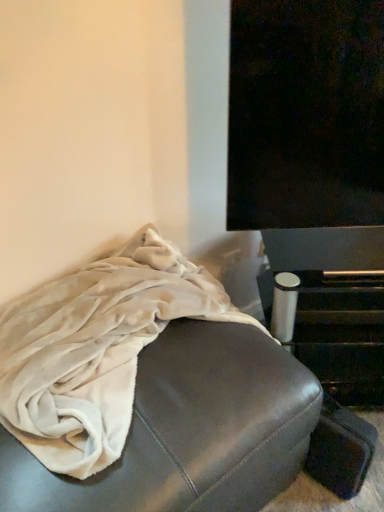
I want to click on velvet-like beige blanket draped over leather ottoman at lower left, so click(190, 430).

What do you see at coordinates (190, 430) in the screenshot?
I see `velvet-like beige blanket draped over leather ottoman at lower left` at bounding box center [190, 430].

You are a GUI agent. You are given a task and a screenshot of the screen. Output one action in this format:
    pyautogui.click(x=<x>, y=<y>)
    Task: Click on the velvet-like beige blanket draped over leather ottoman at lower left
    The image size is (384, 512).
    Given the screenshot: What is the action you would take?
    pyautogui.click(x=190, y=430)